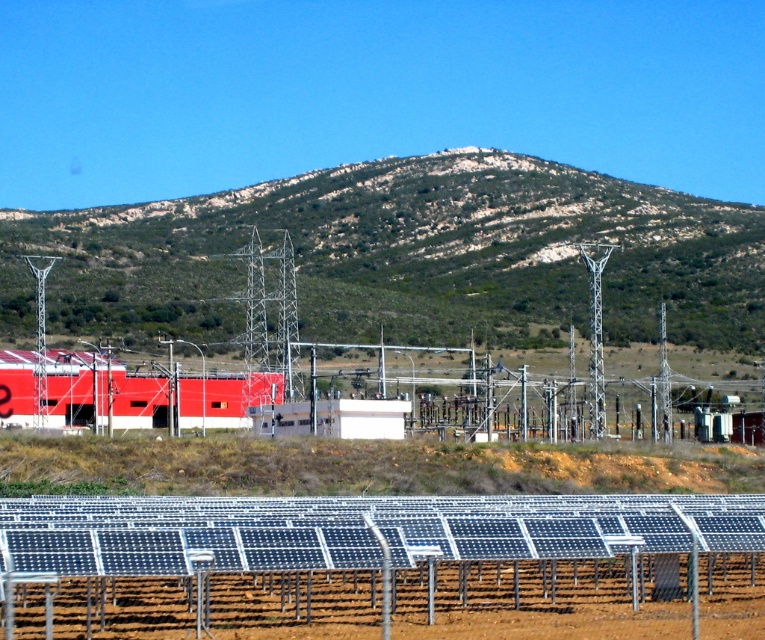
You are standing at the entrance of the solar power plant and want to locate two specific points marked on the map. The first point is at coordinates point (503, 314) and the second is at point (210, 596). Which of these two points is closer to your current position?

Point (503, 314) is further to the viewer than point (210, 596). Therefore, the point closer to your current position is point (210, 596).

Looking at this image, you are a maintenance worker at the solar power plant and need to access the green textured hill at center to inspect equipment. However, there is a metallic silver fence at lower center blocking your path. Can you walk around the fence to reach the hill?

The green textured hill at center is located above the metallic silver fence at lower center, which means the fence is lower in position relative to the hill. Since the fence is at a lower elevation, you can walk around it to access the hill.

You are planning to install a new solar panel array and need to choose between placing it on the green textured hill at center or near the metallic silver fence at lower center. Based on their sizes, which location would allow for a larger installation area?

The green textured hill at center is larger in size than the metallic silver fence at lower center, so placing the new solar panel array on the green textured hill at center would allow for a larger installation area.